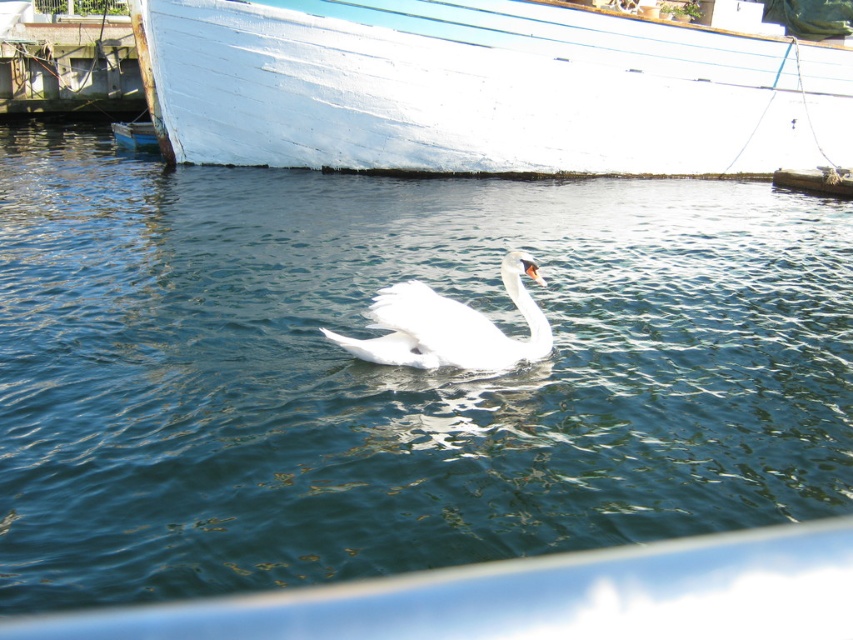
Is white matte boat at upper center shorter than white feathered swan at center?

No.

Between point (459, 157) and point (518, 284), which one is positioned in front?

Point (518, 284) is in front.

You are a GUI agent. You are given a task and a screenshot of the screen. Output one action in this format:
    pyautogui.click(x=<x>, y=<y>)
    Task: Click on the white matte boat at upper center
    The width and height of the screenshot is (853, 640).
    Given the screenshot: What is the action you would take?
    [489, 88]